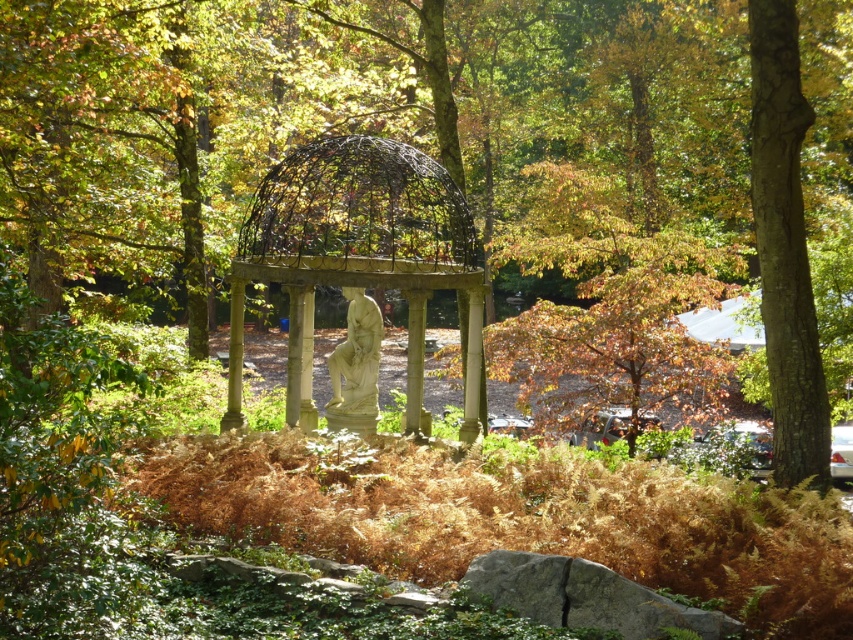
Is green rough bark tree at right positioned at the back of light beige stone statue at center?

No, green rough bark tree at right is closer to the viewer.

I want to click on green rough bark tree at right, so click(785, 246).

Looking at this image, is green rough bark tree at right smaller than white stone column at center?

No, green rough bark tree at right is not smaller than white stone column at center.

Is point (770, 364) positioned after point (469, 420)?

No, (770, 364) is in front of (469, 420).

Does point (767, 45) lie behind point (477, 344)?

No, (767, 45) is in front of (477, 344).

The height and width of the screenshot is (640, 853). What are the coordinates of `green rough bark tree at right` in the screenshot? It's located at (785, 246).

Is matte black gazebo at center smaller than green rough bark tree at right?

Indeed, matte black gazebo at center has a smaller size compared to green rough bark tree at right.

Can you confirm if matte black gazebo at center is positioned to the right of green rough bark tree at right?

No, matte black gazebo at center is not to the right of green rough bark tree at right.

Measure the distance between point (469,296) and camera.

Point (469,296) and camera are 18.74 meters apart from each other.

Locate an element on the screen. The height and width of the screenshot is (640, 853). matte black gazebo at center is located at coordinates (357, 253).